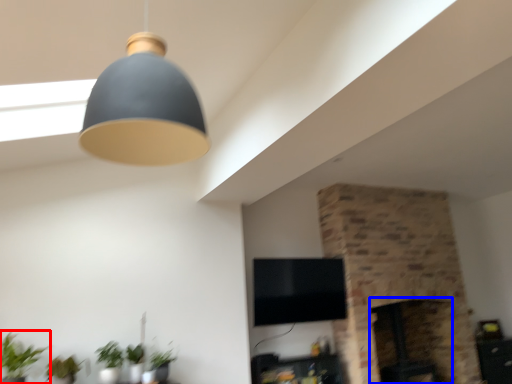
Question: Which point is closer to the camera, houseplant (highlighted by a red box) or fireplace (highlighted by a blue box)?

Choices:
 (A) houseplant
 (B) fireplace

Answer: (A)